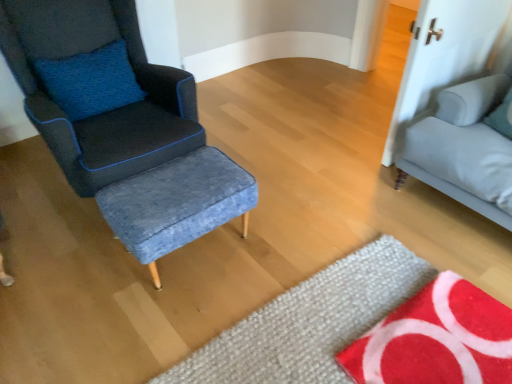
Locate an element on the screen. This screenshot has height=384, width=512. vacant space to the left of red textured mat at lower right, acting as the second mat starting from the left is located at coordinates (310, 327).